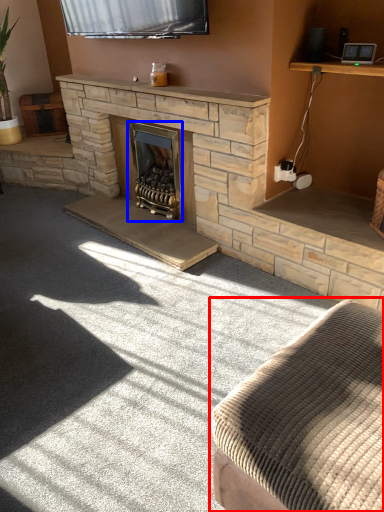
Question: Which of the following is the closest to the observer, studio couch (highlighted by a red box) or wood burning stove (highlighted by a blue box)?

Choices:
 (A) studio couch
 (B) wood burning stove

Answer: (A)